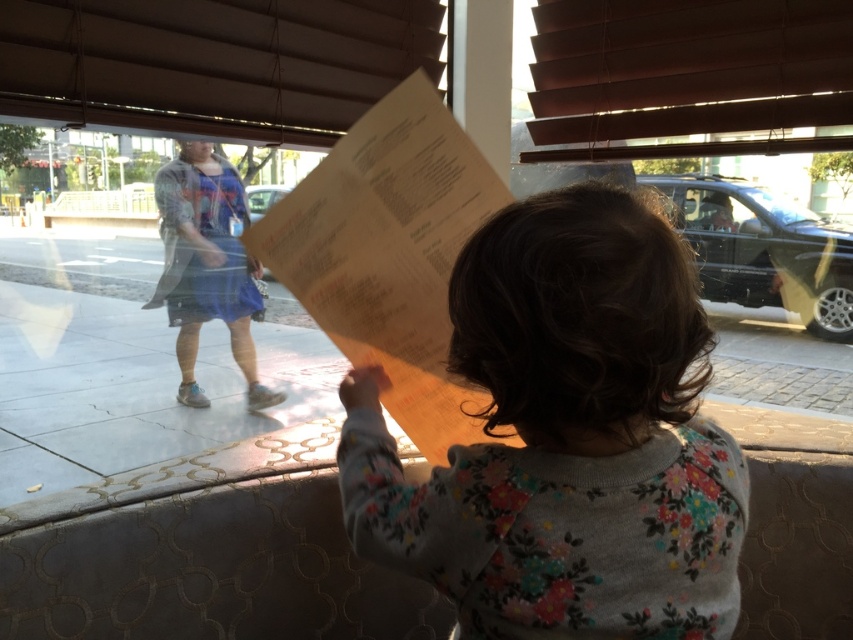
Question: Is fluffy gray sweater at center further to the viewer compared to blue fabric dress at center?

Choices:
 (A) yes
 (B) no

Answer: (B)

Question: Which of the following is the closest to the observer?

Choices:
 (A) fluffy gray sweater at center
 (B) blue fabric dress at center

Answer: (A)

Question: Among these points, which one is farthest from the camera?

Choices:
 (A) (202, 397)
 (B) (514, 248)

Answer: (A)

Question: Does fluffy gray sweater at center appear over blue fabric dress at center?

Choices:
 (A) yes
 (B) no

Answer: (B)

Question: Is fluffy gray sweater at center below blue fabric dress at center?

Choices:
 (A) yes
 (B) no

Answer: (A)